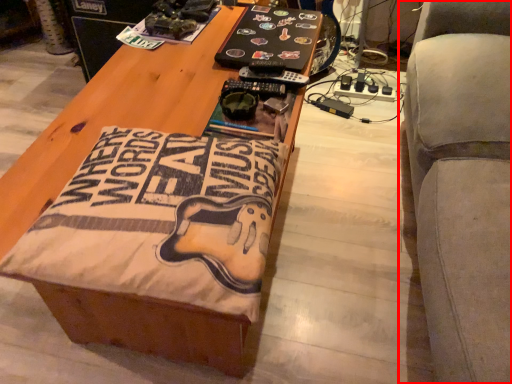
Question: From the image, what is the correct spatial relationship of furniture (annotated by the red box) in relation to table?

Choices:
 (A) right
 (B) left

Answer: (A)